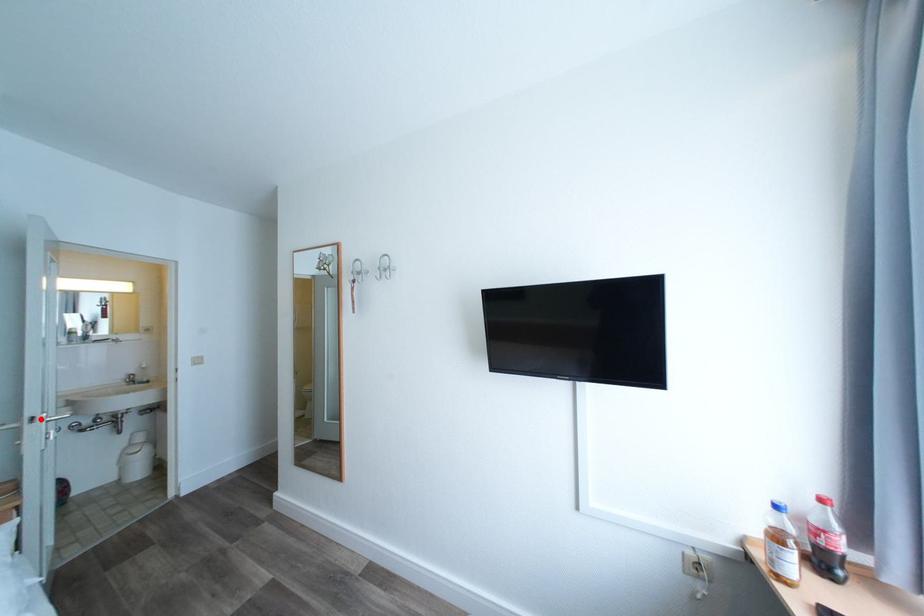
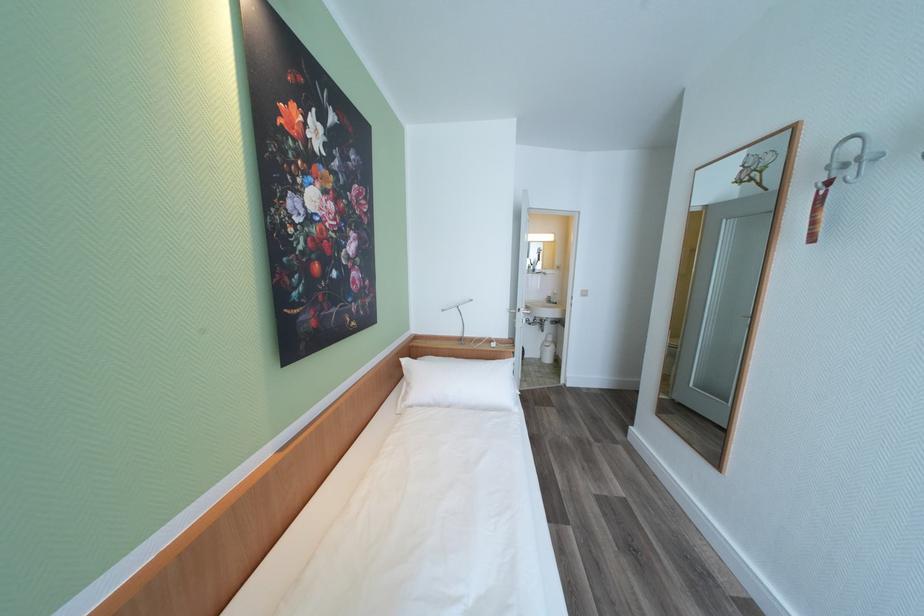
Find the pixel in the second image that matches the highlighted location in the first image.

(527, 310)